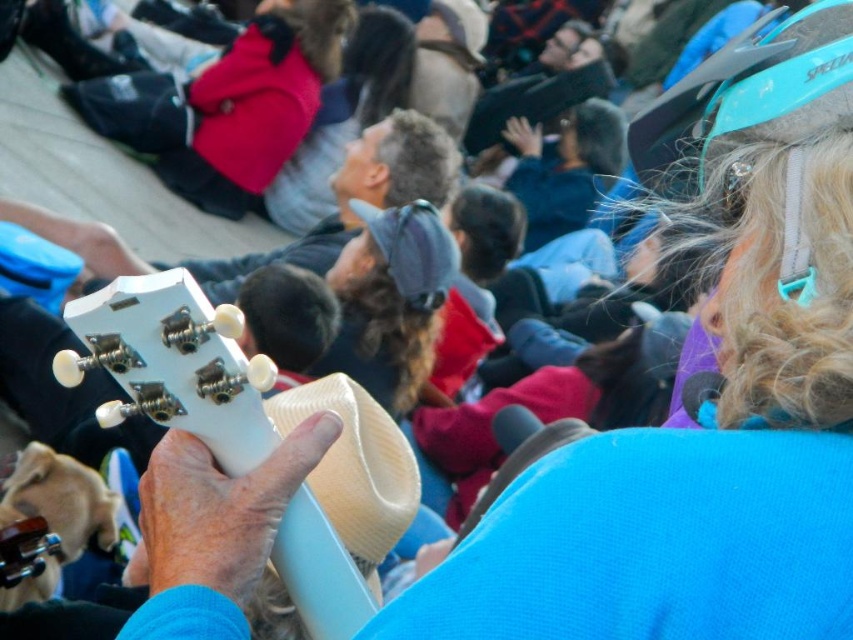
Can you confirm if white matte guitar at center is positioned below matte white ukulele at center?

Yes.

Which is behind, point (125, 364) or point (396, 147)?

The point (396, 147) is more distant.

Is point (172, 339) farther from camera compared to point (216, 266)?

No, it is not.

I want to click on white matte guitar at center, so click(x=173, y=364).

Is point (102, 276) in front of point (532, 132)?

That is True.

Is matte white ukulele at center taller than blue fabric jacket at center?

Indeed, matte white ukulele at center has a greater height compared to blue fabric jacket at center.

Between point (238, 268) and point (573, 112), which one is positioned in front?

Positioned in front is point (238, 268).

Where is `matte white ukulele at center`? This screenshot has height=640, width=853. matte white ukulele at center is located at coordinates (357, 196).

Based on the photo, can you confirm if matte white ukulele at center is positioned below beige woven cowboy hat at center?

Incorrect, matte white ukulele at center is not positioned below beige woven cowboy hat at center.

Measure the distance between matte white ukulele at center and camera.

They are 34.95 meters apart.

The width and height of the screenshot is (853, 640). I want to click on matte white ukulele at center, so click(x=357, y=196).